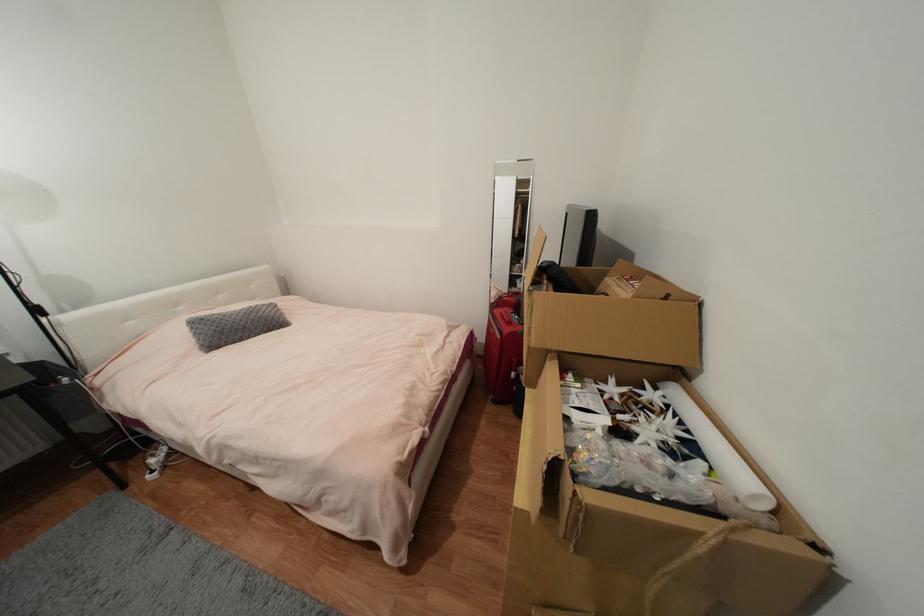
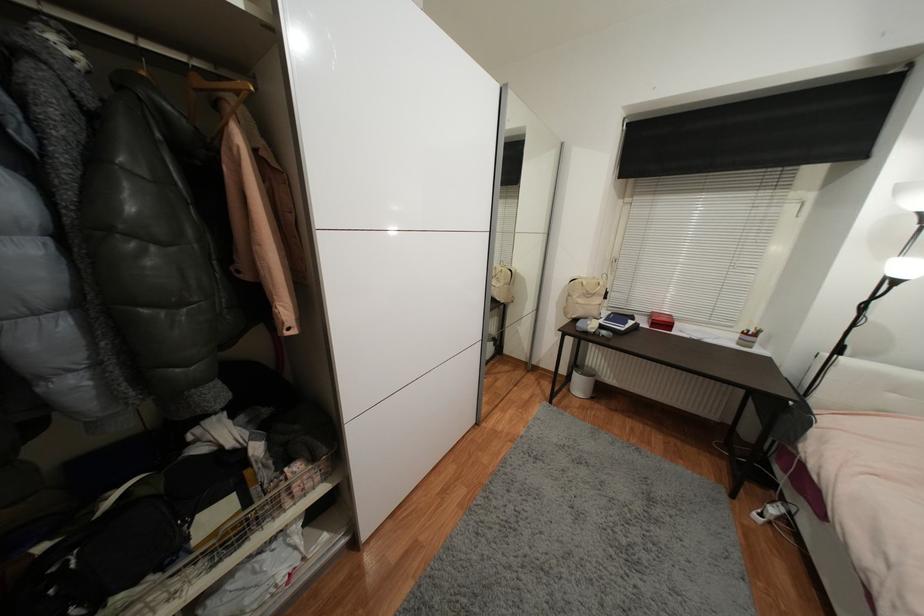
The images are taken continuously from a first-person perspective. In which direction is your viewpoint rotating?

The rotation direction of the camera is left-down.